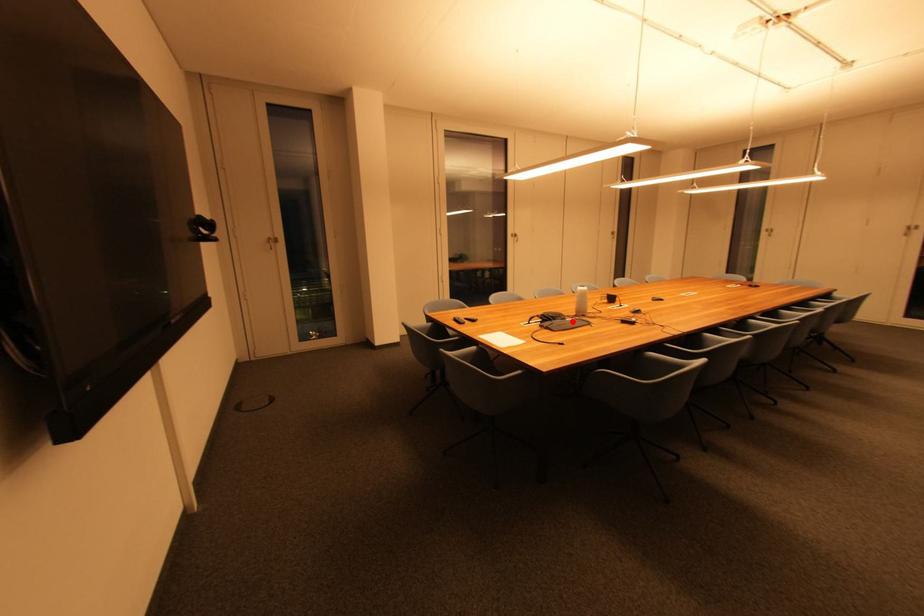
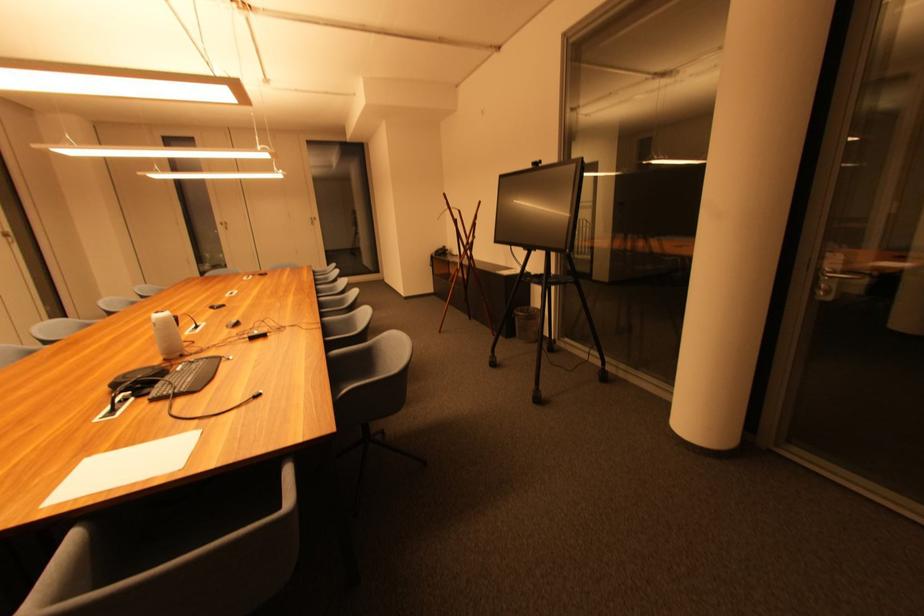
Locate, in the second image, the point that corresponds to the highlighted location in the first image.

(184, 371)